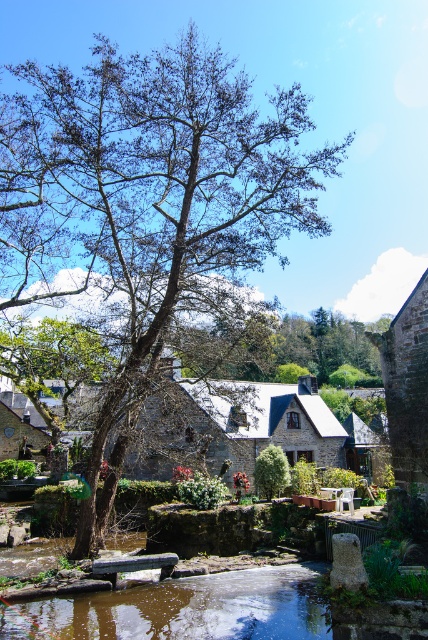
You are a tourist visiting this village and want to take a photo that includes both the bare wood tree at center and the stone village at center. Which object should you position closer to the camera to ensure both are fully visible in the frame?

You should position the bare wood tree at center closer to the camera since it is taller than the stone village at center, ensuring both fit within the frame.